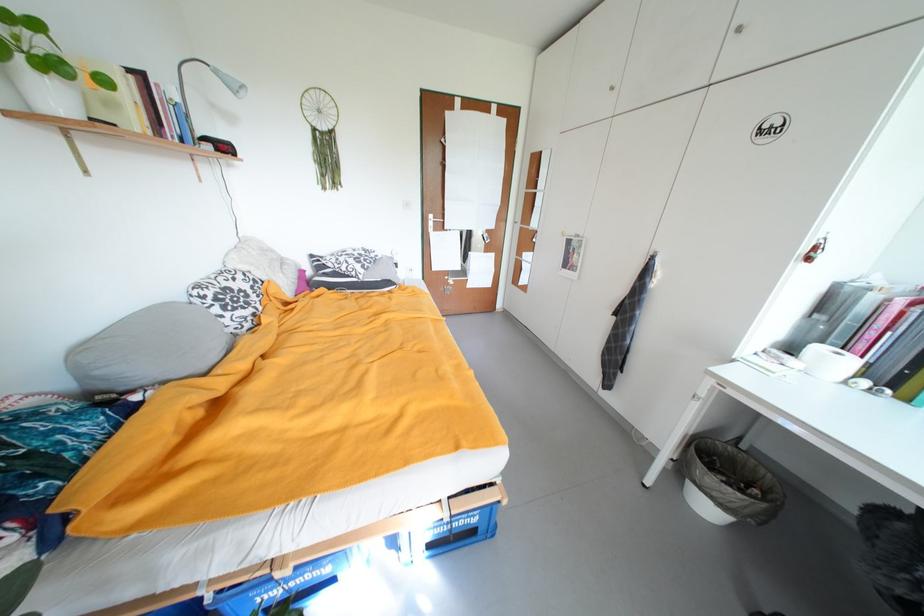
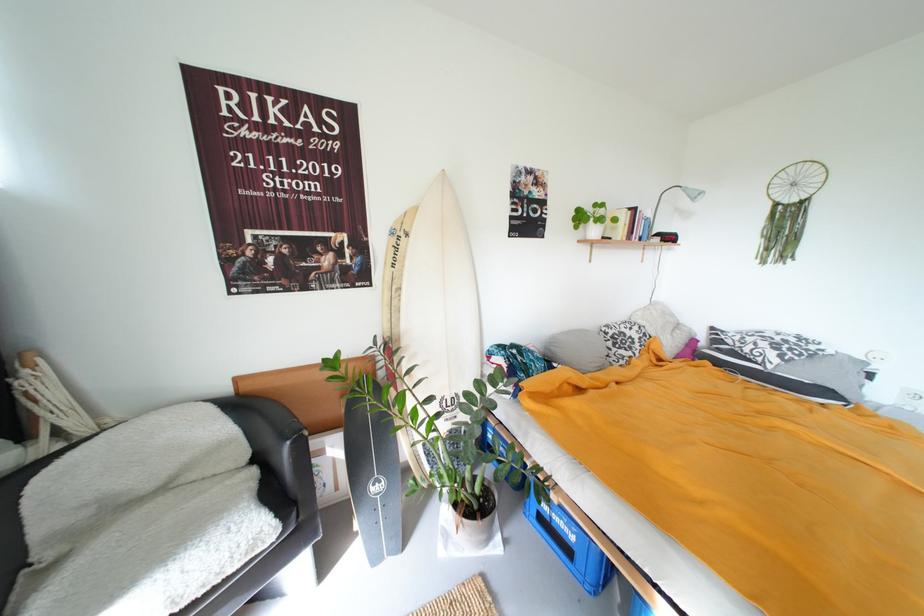
In the second image, find the point that corresponds to pixel 169 127 in the first image.

(639, 235)